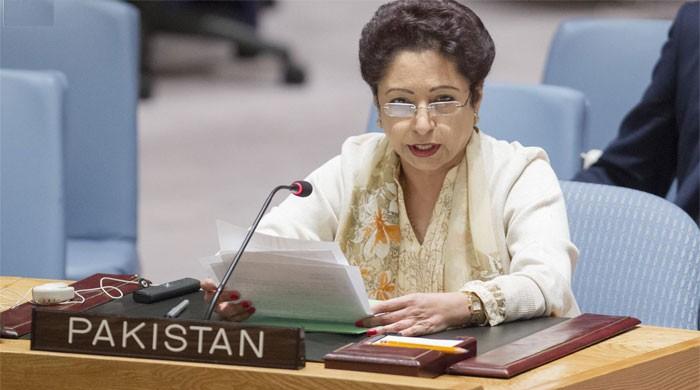
What are the coordinates of `carpet` in the screenshot? It's located at (223, 137).